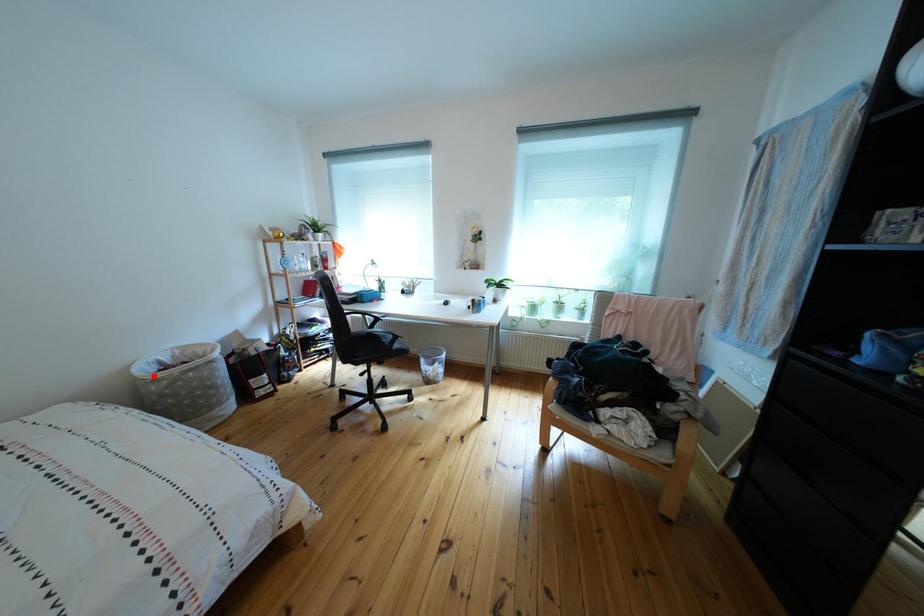
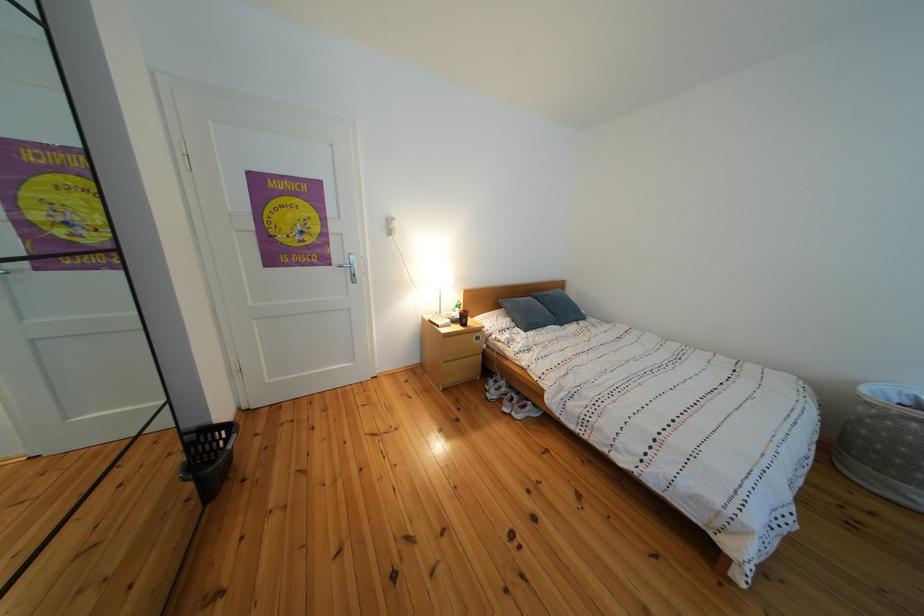
Where in the second image is the point corresponding to the highlighted location from the first image?

(890, 398)